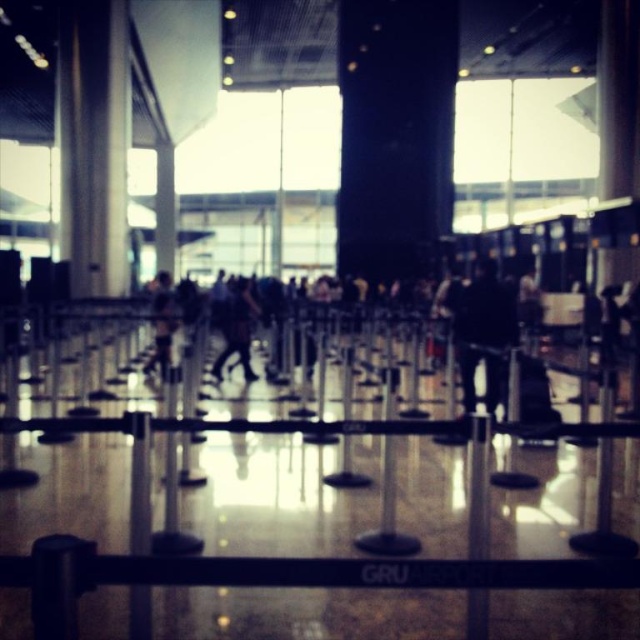
Question: Does dark gray fabric bag at center have a greater width compared to dark blue jeans at center?

Choices:
 (A) yes
 (B) no

Answer: (B)

Question: Does dark gray fabric bag at center come in front of dark blue jeans at center?

Choices:
 (A) yes
 (B) no

Answer: (B)

Question: Which point is farther from the camera taking this photo?

Choices:
 (A) (243, 280)
 (B) (157, 312)

Answer: (A)

Question: Which of the following is the closest to the observer?

Choices:
 (A) dark gray fabric bag at center
 (B) dark blue jeans at center

Answer: (B)

Question: Does dark gray fabric bag at center have a smaller size compared to dark blue jeans at center?

Choices:
 (A) yes
 (B) no

Answer: (A)